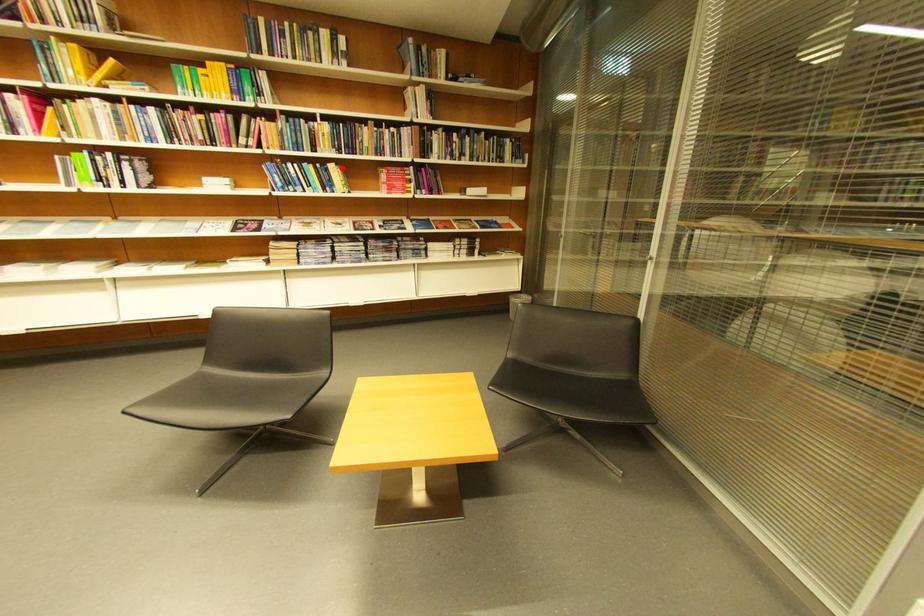
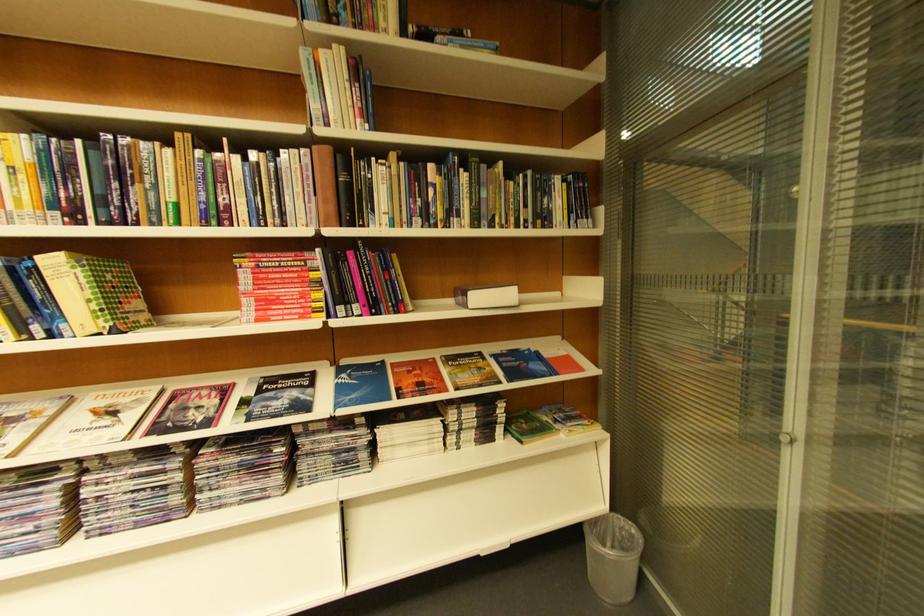
In the second image, find the point that corresponds to the highlighted location in the first image.

(63, 264)